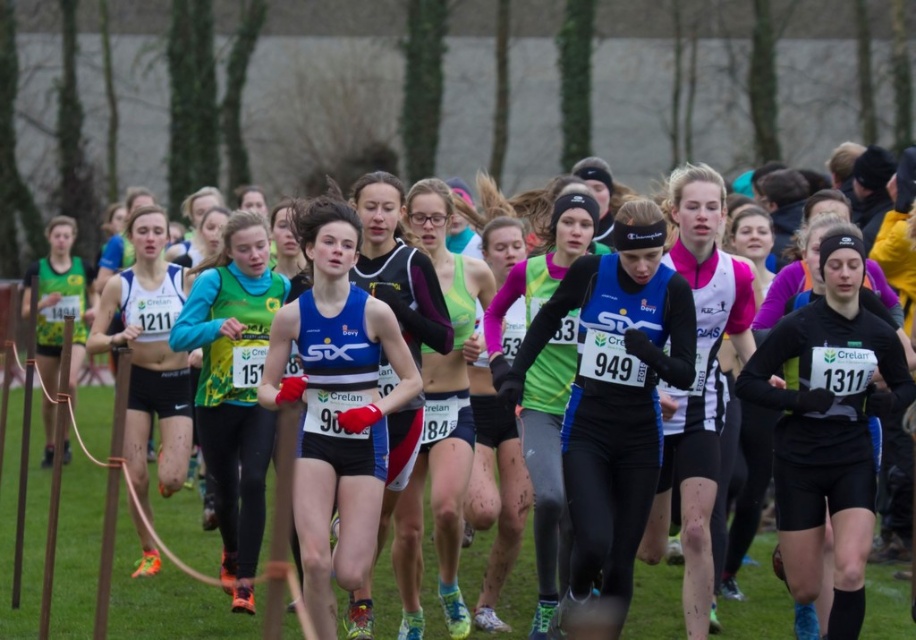
You are a photographer trying to capture a photo of the runners. You want to ensure both the black matte running suit at center and the matte blue tank top at center are clearly visible in the frame. Given their sizes, which runner should you focus on to ensure the entire body is in the frame without cropping?

The black matte running suit at center is wider than the matte blue tank top at center. Therefore, focusing on the black matte running suit at center ensures the entire body fits in the frame as it occupies more space.

You are a photographer trying to capture a photo of the black matte running suit at center and the green jersey at center. Since you want to ensure both are fully visible in the frame, which runner should you position closer to the camera?

The black matte running suit at center is not as tall as the green jersey at center, so you should position the black matte running suit at center closer to the camera to ensure both are fully visible in the frame.

You are a photographer standing at the origin point of the image coordinate system. You want to capture a closeup shot of the black matte running suit at center. What are the coordinates where you should aim your camera?

The coordinates to aim the camera are at point (827, 426) to capture the black matte running suit at center.